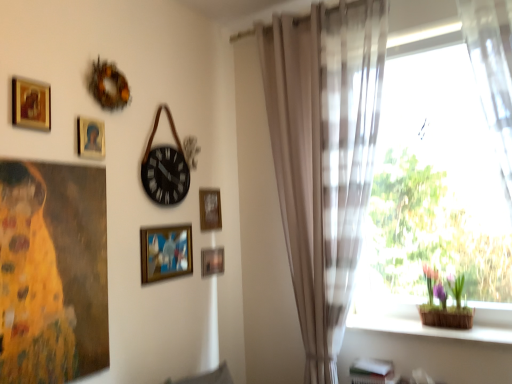
Question: Considering the positions of point (96, 152) and point (218, 211), is point (96, 152) closer or farther from the camera than point (218, 211)?

Choices:
 (A) closer
 (B) farther

Answer: (A)

Question: Do you think gold-framed portrait at upper left, marked as the second picture frame in a top-to-bottom arrangement, is within wooden frame at upper center, the fifth picture frame from the front, or outside of it?

Choices:
 (A) outside
 (B) inside

Answer: (A)

Question: Estimate the real-world distances between objects in this image. Which object is farther from the metallic gold picture frame at lower center, marked as the first picture frame in a bottom-to-top arrangement?

Choices:
 (A) wooden basket at lower right
 (B) oil painting of woman at left
 (C) sheer beige curtain at right
 (D) wooden frame at upper center, the fifth picture frame from the front
 (E) gold-framed picture at upper left, the 1th picture frame viewed from the top

Answer: (E)

Question: Which object is positioned closest to the gold-framed picture at upper left, arranged as the 1th picture frame when viewed from the front?

Choices:
 (A) sheer beige curtain at right
 (B) green leafy plant at right
 (C) translucent fabric at right
 (D) wooden basket at lower right
 (E) oil painting of woman at left

Answer: (E)